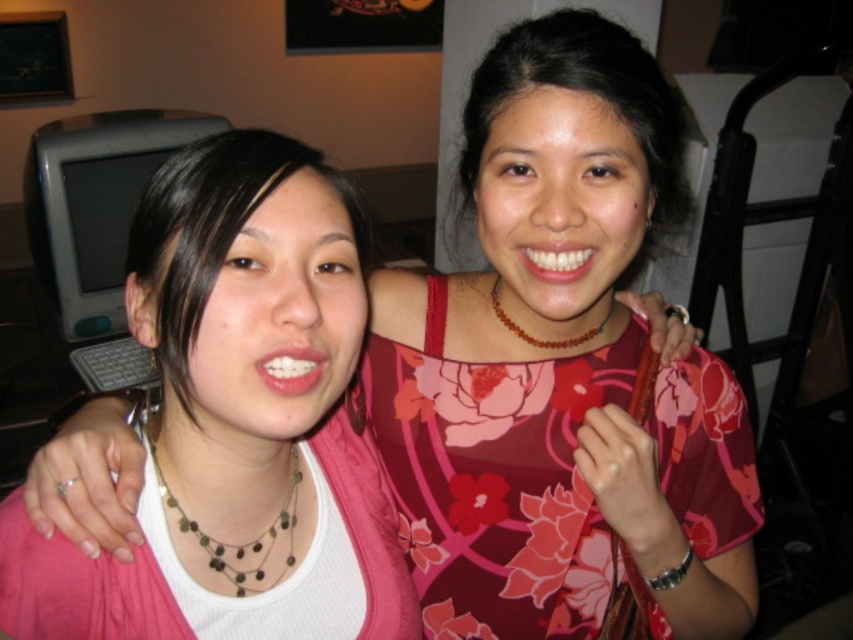
You are trying to decide which item to grab first from the center area. The pink fabric shirt at center and the green stone necklace at center are both in your view. Which one is located to the right side?

The pink fabric shirt at center is positioned on the right side of the green stone necklace at center, so the pink fabric shirt at center is located to the right side.

You are standing in the room and want to locate the floral print fabric dress at center. According to the coordinates provided, where exactly should you look?

The floral print fabric dress at center is located at point (496, 480).